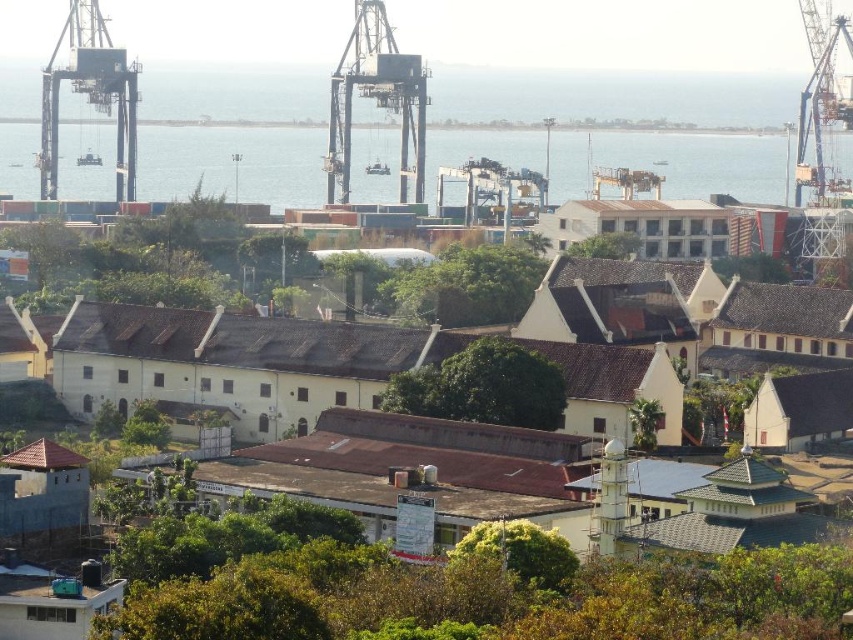
Does metallic industrial crane at center have a larger size compared to metallic industrial crane at upper right?

Correct, metallic industrial crane at center is larger in size than metallic industrial crane at upper right.

Is point (329, 188) farther from camera compared to point (817, 164)?

That is True.

Find the location of a particular element. Image resolution: width=853 pixels, height=640 pixels. metallic industrial crane at center is located at coordinates (375, 99).

Between point (422, 166) and point (41, 122), which one is positioned in front?

Point (422, 166) is more forward.

I want to click on metallic industrial crane at center, so click(x=375, y=99).

Locate an element on the screen. metallic industrial crane at center is located at coordinates (375, 99).

Between point (68, 72) and point (833, 186), which one is positioned behind?

The point (68, 72) is behind.

What do you see at coordinates (90, 93) in the screenshot? Image resolution: width=853 pixels, height=640 pixels. I see `metallic gray crane at upper left` at bounding box center [90, 93].

Identify the location of metallic gray crane at upper left. The width and height of the screenshot is (853, 640). (90, 93).